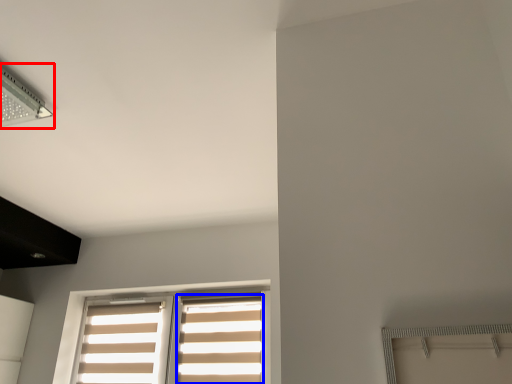
Question: Which object is further to the camera taking this photo, lamp (highlighted by a red box) or curtain (highlighted by a blue box)?

Choices:
 (A) lamp
 (B) curtain

Answer: (B)